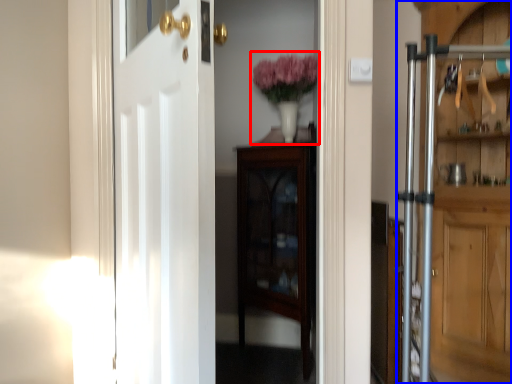
Question: Which object is closer to the camera taking this photo, floral arrangement (highlighted by a red box) or door (highlighted by a blue box)?

Choices:
 (A) floral arrangement
 (B) door

Answer: (B)